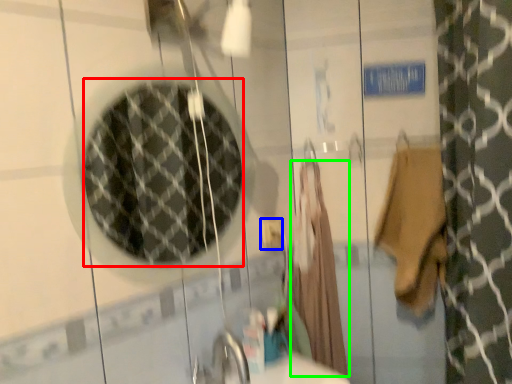
Question: Which object is the farthest from mirror (highlighted by a red box)? Choose among these: electric outlet (highlighted by a blue box) or robe (highlighted by a green box).

Choices:
 (A) electric outlet
 (B) robe

Answer: (A)